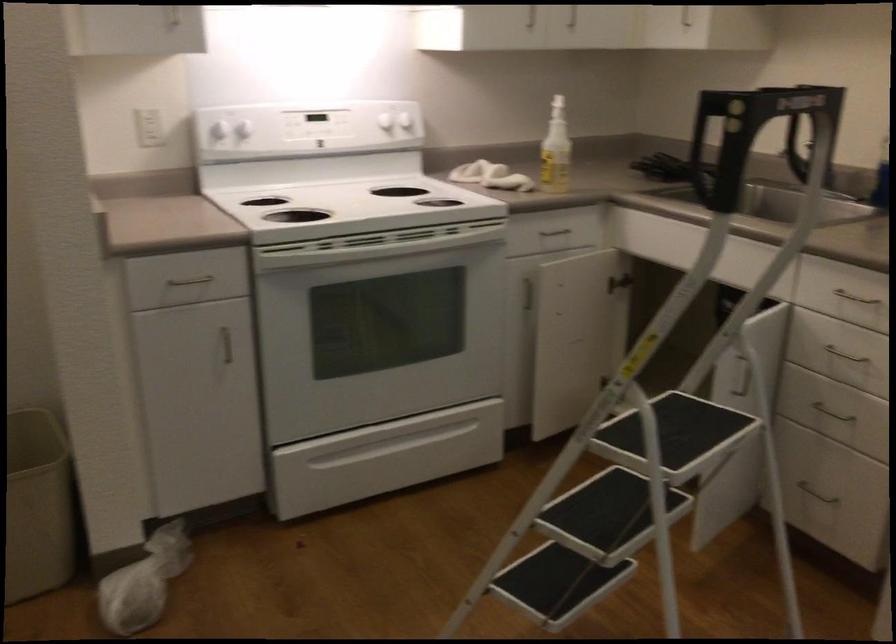
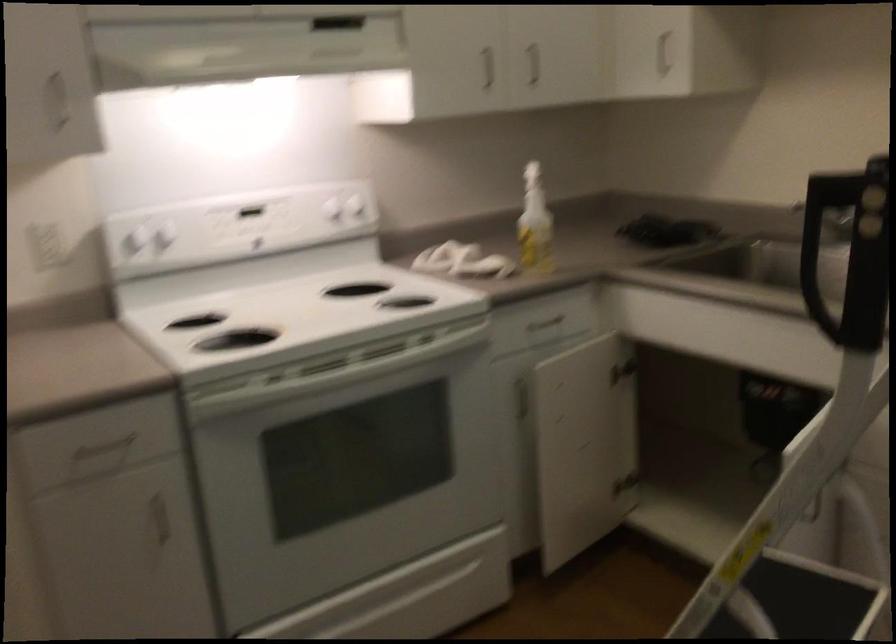
Where in the second image is the point corresponding to (x=412, y=446) from the first image?

(409, 596)